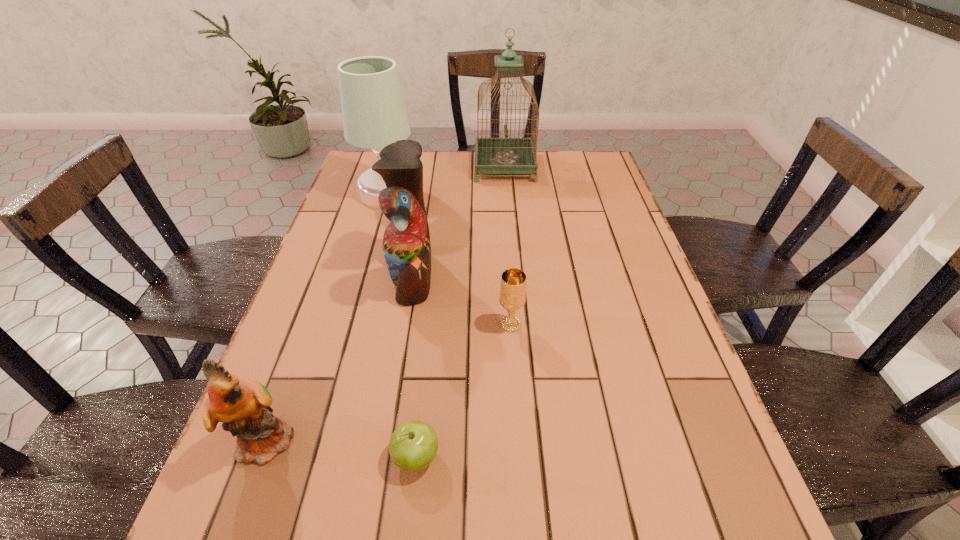
Locate an element on the screen. This screenshot has width=960, height=540. parrot at the left edge is located at coordinates (243, 406).

Identify the location of object that is at the far left corner. This screenshot has width=960, height=540. (374, 115).

Locate an element on the screen. The height and width of the screenshot is (540, 960). vacant space at the far edge of the desktop is located at coordinates (436, 167).

Where is `vacant space at the left edge of the desktop`? vacant space at the left edge of the desktop is located at coordinates 310,350.

This screenshot has height=540, width=960. Find the location of `free space at the right edge of the desktop`. free space at the right edge of the desktop is located at coordinates (637, 342).

This screenshot has width=960, height=540. Identify the location of vacant space at the far left corner. (352, 171).

Locate an element on the screen. This screenshot has height=540, width=960. vacant space at the far right corner of the desktop is located at coordinates (593, 172).

Find the location of a particular element. free spot between the fourth shortest object and the birdcage is located at coordinates (459, 221).

Where is `free space between the lampshade and the birdcage`? The image size is (960, 540). free space between the lampshade and the birdcage is located at coordinates (446, 180).

Identify the location of free space between the fourth nearest object and the birdcage. The height and width of the screenshot is (540, 960). (459, 221).